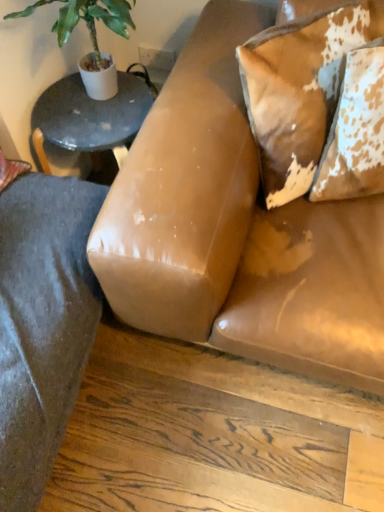
Question: Should I look upward or downward to see green leafy plant at upper left?

Choices:
 (A) up
 (B) down

Answer: (A)

Question: Considering the relative sizes of green leafy plant at upper left and leather couch at center in the image provided, is green leafy plant at upper left shorter than leather couch at center?

Choices:
 (A) no
 (B) yes

Answer: (B)

Question: Does green leafy plant at upper left lie behind leather couch at center?

Choices:
 (A) no
 (B) yes

Answer: (B)

Question: Is green leafy plant at upper left thinner than leather couch at center?

Choices:
 (A) yes
 (B) no

Answer: (A)

Question: From a real-world perspective, is green leafy plant at upper left located beneath leather couch at center?

Choices:
 (A) no
 (B) yes

Answer: (A)

Question: Can we say green leafy plant at upper left lies outside leather couch at center?

Choices:
 (A) no
 (B) yes

Answer: (B)

Question: Is green leafy plant at upper left bigger than leather couch at center?

Choices:
 (A) no
 (B) yes

Answer: (A)

Question: Does leather couch at center lie behind green leafy plant at upper left?

Choices:
 (A) yes
 (B) no

Answer: (B)

Question: Can you confirm if leather couch at center is taller than green leafy plant at upper left?

Choices:
 (A) yes
 (B) no

Answer: (A)

Question: Are leather couch at center and green leafy plant at upper left located far from each other?

Choices:
 (A) yes
 (B) no

Answer: (B)

Question: Is green leafy plant at upper left completely or partially inside leather couch at center?

Choices:
 (A) no
 (B) yes

Answer: (A)

Question: Is the position of leather couch at center less distant than that of green leafy plant at upper left?

Choices:
 (A) yes
 (B) no

Answer: (A)

Question: Considering the relative sizes of leather couch at center and green leafy plant at upper left in the image provided, is leather couch at center thinner than green leafy plant at upper left?

Choices:
 (A) yes
 (B) no

Answer: (B)

Question: Is speckled leather pillow at upper right, marked as the 1th pillow in a left-to-right arrangement, not close to green leafy plant at upper left?

Choices:
 (A) yes
 (B) no

Answer: (B)